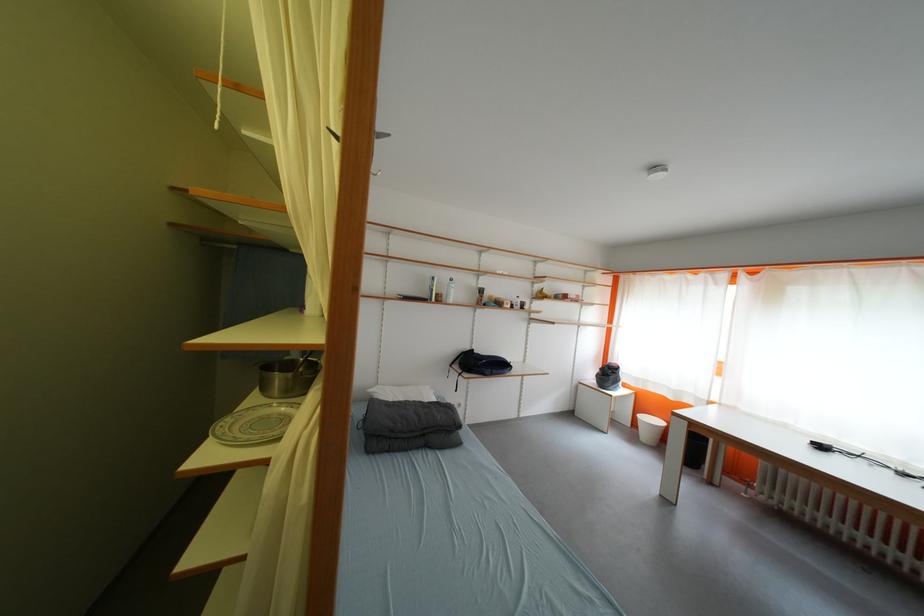
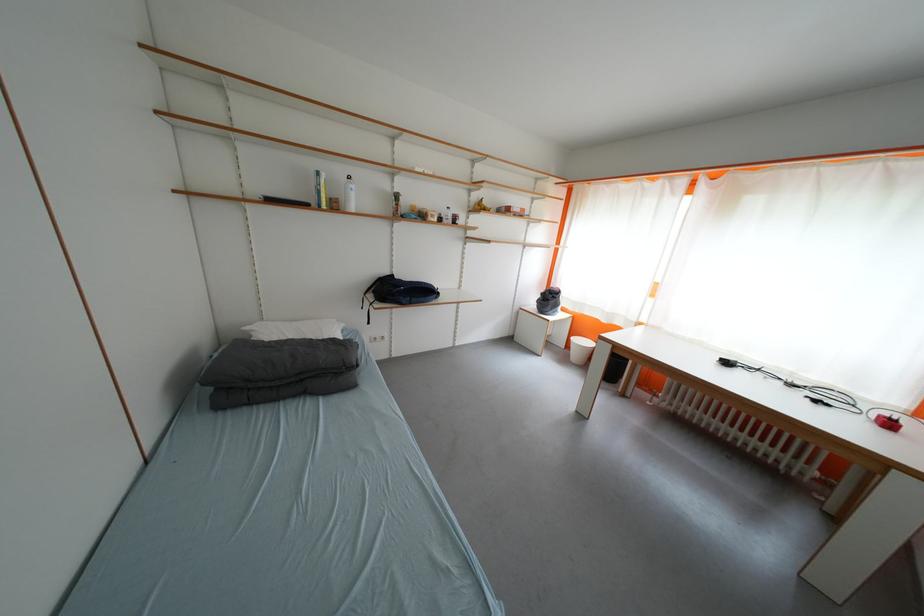
In the second image, find the point that corresponds to the point at 481,354 in the first image.

(400, 278)